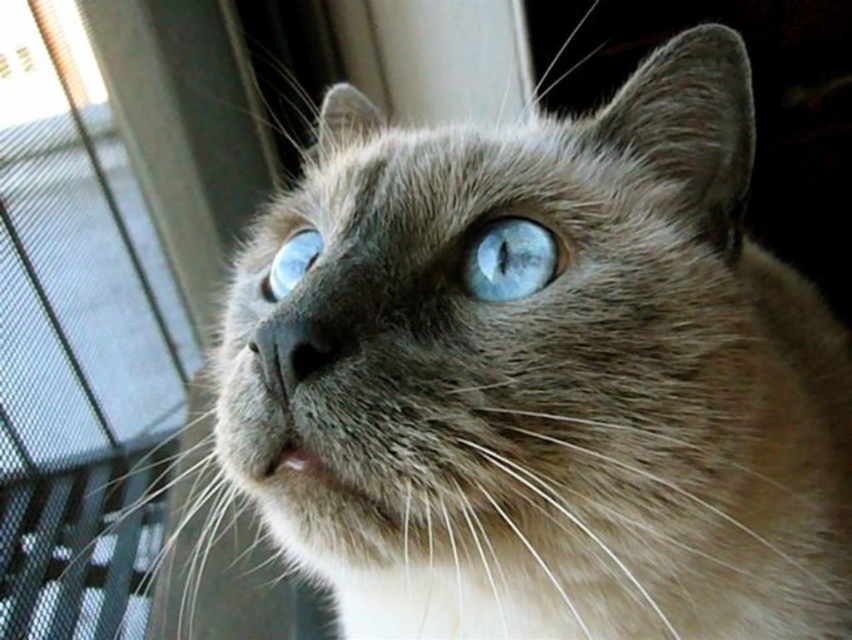
You are a cat sitting in front of the transparent glass door at left and the blue glossy eye at upper center. Which object is closer to you?

The transparent glass door at left is closer to you because it is further to the viewer than the blue glossy eye at upper center, meaning the eye is actually farther away.

Looking at the cat in the image, which blue glossy eye is positioned to the right of the other? Specifically, is the blue glossy eye at center to the right of the blue glossy eye at upper center?

Yes, the blue glossy eye at center is to the right of the blue glossy eye at upper center according to the description.

Looking at this image, you are a cat sitting in front of the transparent glass door at left and the blue glossy eye at center. You want to look towards the window to see outside. Which object should you turn your head away from?

The transparent glass door at left is to the left of the blue glossy eye at center. To look towards the window, you should turn your head away from the transparent glass door at left because the blue glossy eye at center is already facing the direction of the window.